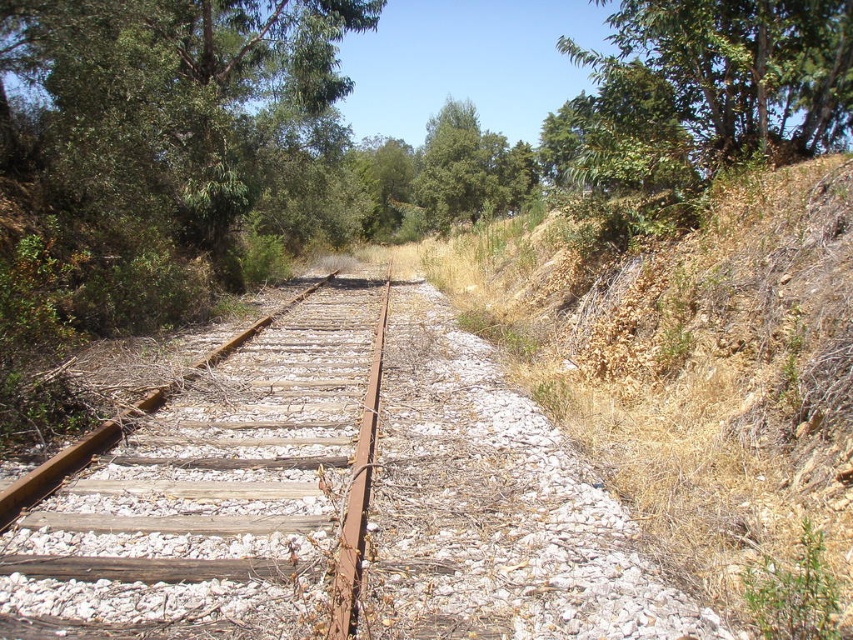
What do you see at coordinates (698, 372) in the screenshot? Image resolution: width=853 pixels, height=640 pixels. I see `dry grass at right` at bounding box center [698, 372].

Does dry grass at right come in front of green leafy tree at upper right?

That is True.

What are the coordinates of `dry grass at right` in the screenshot? It's located at (698, 372).

Can you confirm if dry grass at right is taller than rusty metal train track at center?

Yes.

Is point (798, 380) in front of point (0, 625)?

No.

Does point (817, 372) lie in front of point (50, 579)?

No.

Locate an element on the screen. dry grass at right is located at coordinates coord(698,372).

Is rusty metal train track at center further to the viewer compared to green leafy tree at upper right?

No, rusty metal train track at center is closer to the viewer.

Does point (287, 577) come farther from viewer compared to point (693, 22)?

No, it is not.

The height and width of the screenshot is (640, 853). What do you see at coordinates (215, 483) in the screenshot?
I see `rusty metal train track at center` at bounding box center [215, 483].

Image resolution: width=853 pixels, height=640 pixels. What are the coordinates of `rusty metal train track at center` in the screenshot? It's located at (215, 483).